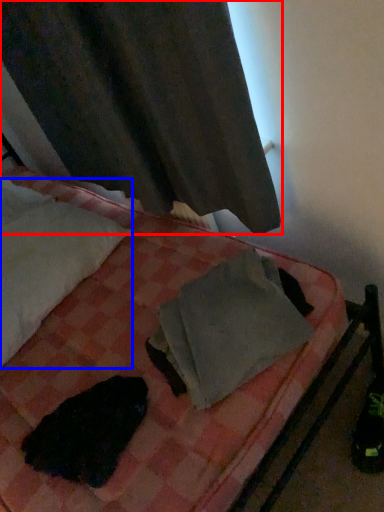
Question: Which object is further to the camera taking this photo, curtain (highlighted by a red box) or pillow (highlighted by a blue box)?

Choices:
 (A) curtain
 (B) pillow

Answer: (B)